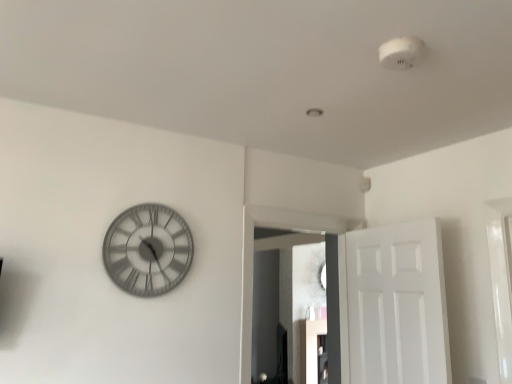
Question: Is metallic gray clock at left to the left or to the right of matte glass mirror at center in the image?

Choices:
 (A) left
 (B) right

Answer: (A)

Question: From their relative heights in the image, would you say metallic gray clock at left is taller or shorter than matte glass mirror at center?

Choices:
 (A) short
 (B) tall

Answer: (A)

Question: Which object is positioned closest to the white matte door at right?

Choices:
 (A) metallic gray clock at left
 (B) matte glass mirror at center

Answer: (A)

Question: Estimate the real-world distances between objects in this image. Which object is farther from the white matte door at right?

Choices:
 (A) metallic gray clock at left
 (B) matte glass mirror at center

Answer: (B)